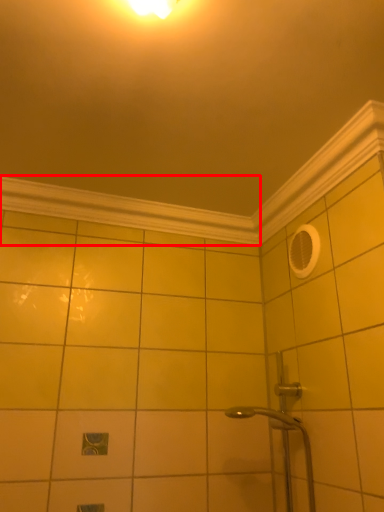
Question: From the image's perspective, where is molding (annotated by the red box) located relative to molding?

Choices:
 (A) below
 (B) above

Answer: (A)